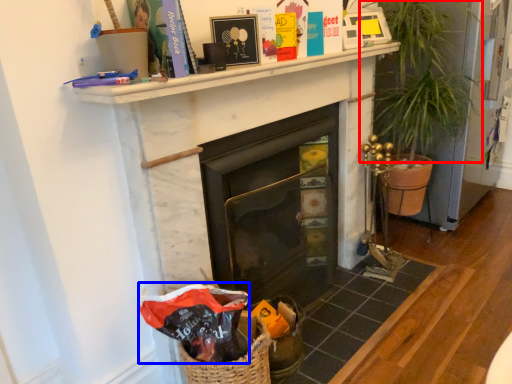
Question: Which object is closer to the camera taking this photo, plant (highlighted by a red box) or gift bag (highlighted by a blue box)?

Choices:
 (A) plant
 (B) gift bag

Answer: (B)